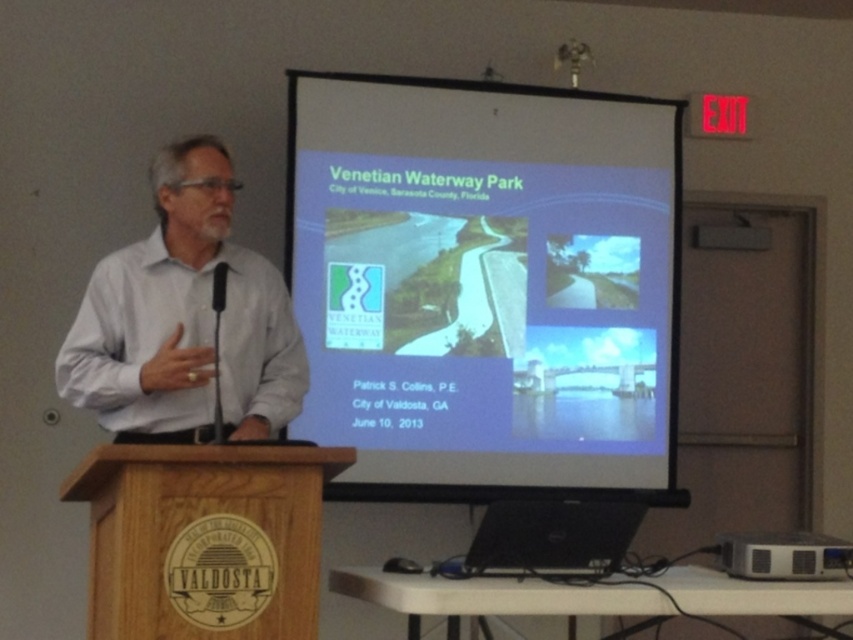
Does white shirt at left have a greater width compared to black plastic projector at lower right?

Yes, white shirt at left is wider than black plastic projector at lower right.

Where is `white shirt at left`? This screenshot has height=640, width=853. white shirt at left is located at coordinates pos(184,317).

Where is `white shirt at left`? white shirt at left is located at coordinates (184, 317).

Image resolution: width=853 pixels, height=640 pixels. In order to click on white shirt at left in this screenshot , I will do `click(184, 317)`.

Is white matte projection screen at center to the right of black plastic projector at lower right from the viewer's perspective?

No, white matte projection screen at center is not to the right of black plastic projector at lower right.

Who is more forward, (339, 420) or (846, 573)?

Positioned in front is point (846, 573).

Locate an element on the screen. Image resolution: width=853 pixels, height=640 pixels. white matte projection screen at center is located at coordinates click(x=485, y=285).

Can you confirm if white matte projection screen at center is positioned above white shirt at left?

Correct, white matte projection screen at center is located above white shirt at left.

Which of these two, white matte projection screen at center or white shirt at left, stands shorter?

With less height is white shirt at left.

Between point (621, 129) and point (219, 214), which one is positioned in front?

Point (219, 214) is more forward.

The width and height of the screenshot is (853, 640). What are the coordinates of `white matte projection screen at center` in the screenshot? It's located at (485, 285).